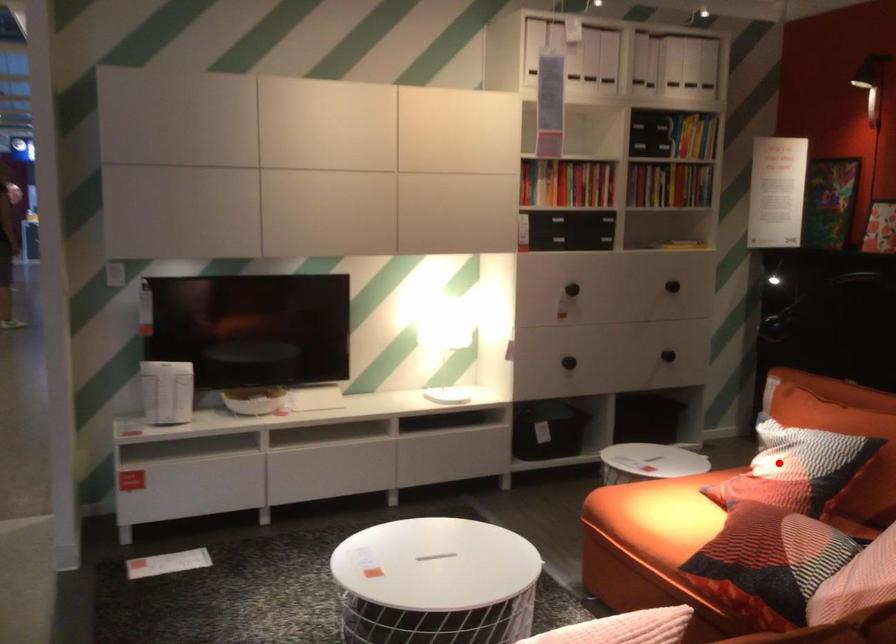
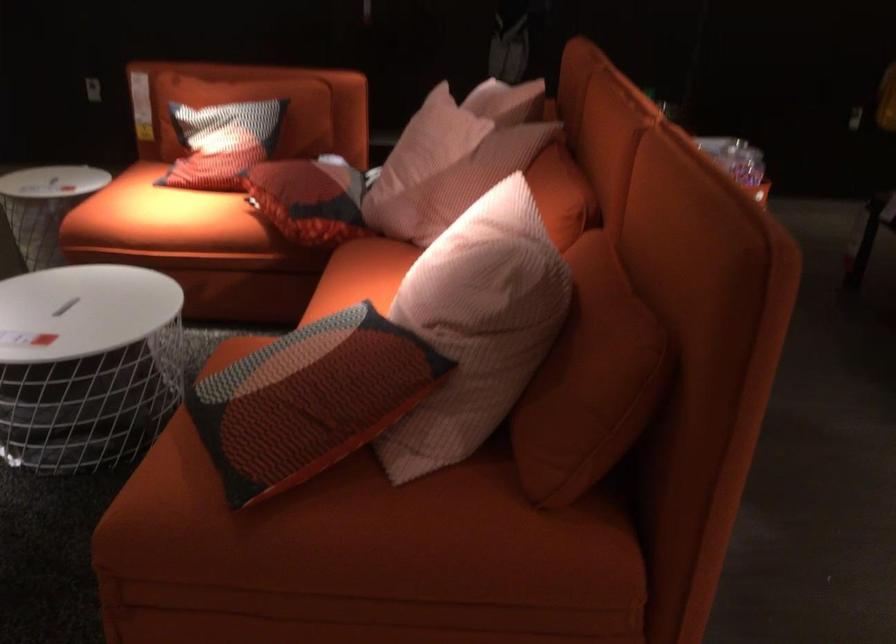
Question: I am providing you with two images of the same scene from different viewpoints. A red point is marked on the first image. At the location where the point appears in image 1, is it still visible in image 2?

Choices:
 (A) Yes
 (B) No

Answer: (A)